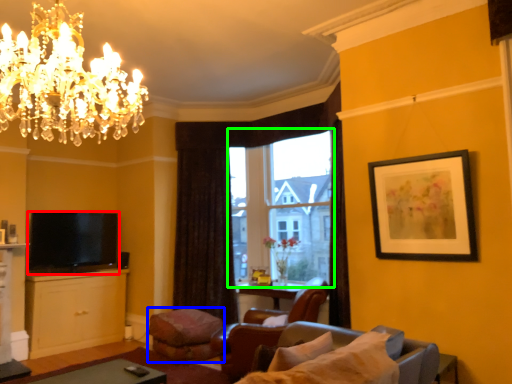
Question: Considering the real-world distances, which object is farthest from television (highlighted by a red box)? footrest (highlighted by a blue box) or window (highlighted by a green box)?

Choices:
 (A) footrest
 (B) window

Answer: (B)